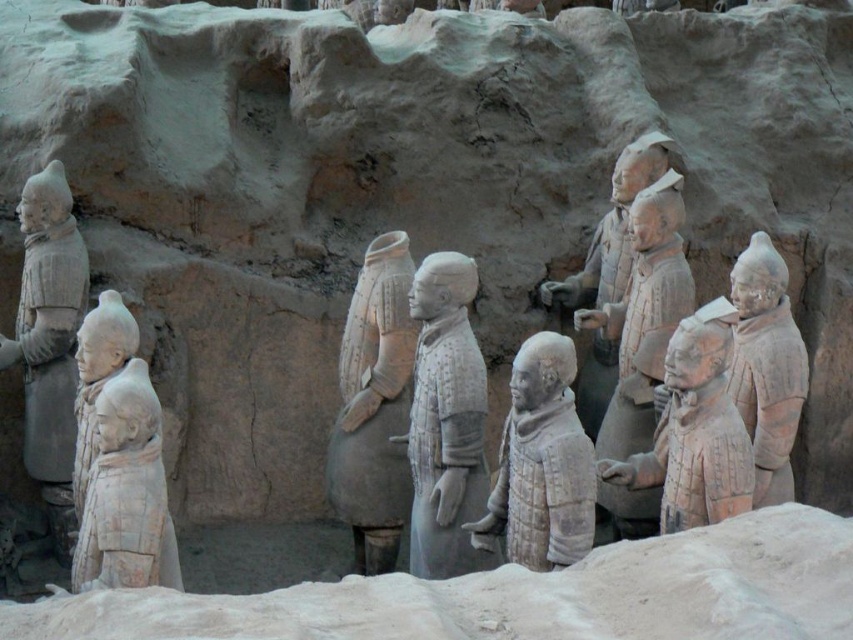
Question: Can you confirm if white matte terracotta warrior at center is bigger than earthenware warrior at right?

Choices:
 (A) yes
 (B) no

Answer: (A)

Question: Which object is the farthest from the white matte armor at center?

Choices:
 (A) earthenware warrior at right
 (B) white clay warrior at center
 (C) earthenware armor at center

Answer: (C)

Question: Where is earthenware armor at center located in relation to white textured armor at center in the image?

Choices:
 (A) below
 (B) above

Answer: (B)

Question: Does white matte armor at center have a smaller size compared to earthenware warrior at right?

Choices:
 (A) yes
 (B) no

Answer: (B)

Question: Which point is closer to the camera taking this photo?

Choices:
 (A) (699, 381)
 (B) (445, 296)
 (C) (138, 561)

Answer: (C)

Question: Which point is farther to the camera?

Choices:
 (A) earthenware warrior at right
 (B) white matte terracotta warrior at center
 (C) white matte armor at center
 (D) white textured armor at center

Answer: (A)